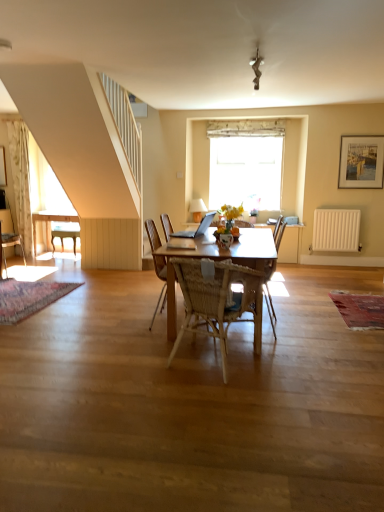
You are a GUI agent. You are given a task and a screenshot of the screen. Output one action in this format:
    pyautogui.click(x=<x>, y=<y>)
    Task: Click on the vacant space to the right of woven wood armchair at center
    This screenshot has width=384, height=512.
    Given the screenshot: What is the action you would take?
    click(322, 329)